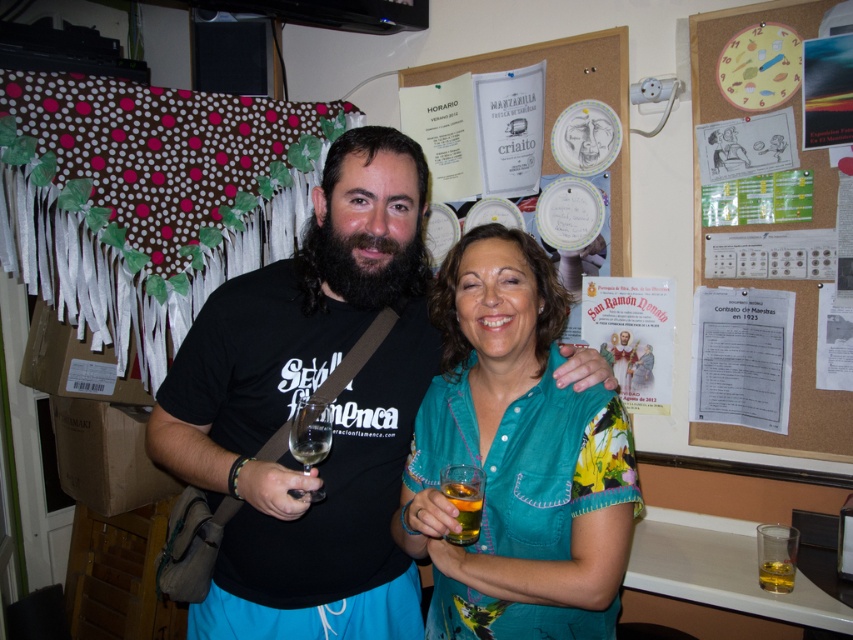
You are standing in the room and want to move from point A to point B. Point A is at coordinate point[296,456] and point B is at coordinate point[776,579]. Which point is closer to you?

Point A at coordinate point[296,456] is closer to you since it is in front of point B at coordinate point[776,579].

You are a photographer standing at a distance of 1 meter from the teal floral blouse at center. Can you capture the entire scene in one photo without moving closer or farther away?

The teal floral blouse at center is 93.96 centimeters away from the viewer. Since 93.96 cm is less than 1 meter, you are actually closer than 1 meter. Therefore, you can capture the entire scene without needing to adjust your distance.